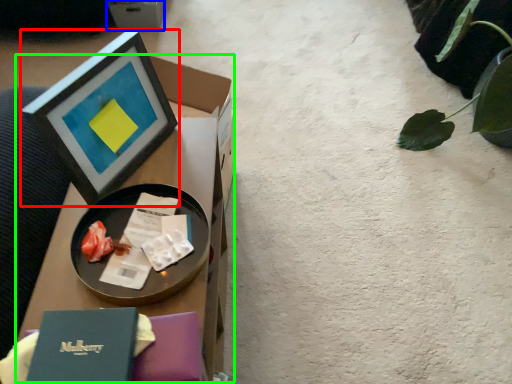
Question: Which object is the closest to the picture frame (highlighted by a red box)? Choose among these: cardboard box (highlighted by a blue box) or table (highlighted by a green box).

Choices:
 (A) cardboard box
 (B) table

Answer: (B)